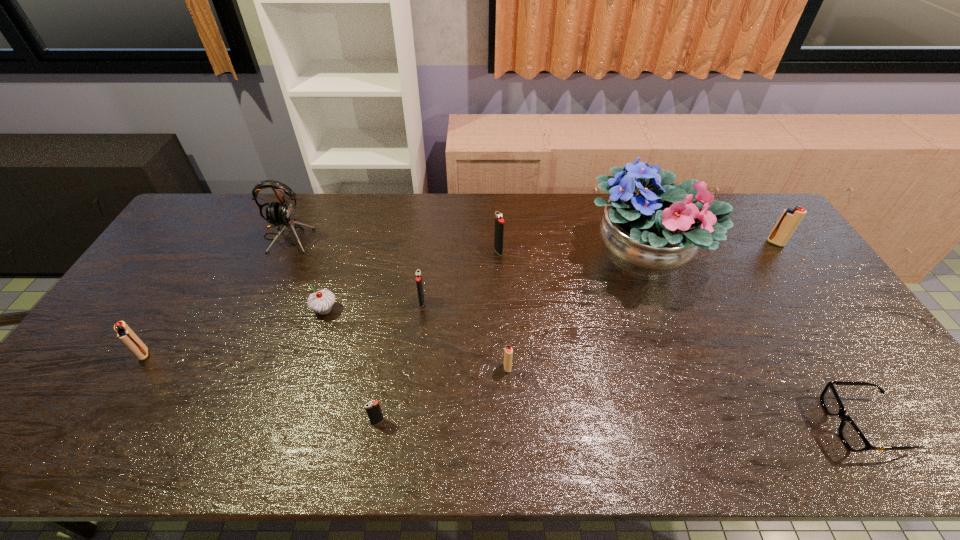
Locate an element on the screen. This screenshot has height=540, width=960. free space that is in between the nearest red igniter and the rightmost igniter is located at coordinates (641, 305).

The height and width of the screenshot is (540, 960). I want to click on vacant region between the rightmost red igniter and the third igniter from left to right, so click(599, 272).

The width and height of the screenshot is (960, 540). Find the location of `empty space between the seventh object from right to left and the rightmost black igniter`. empty space between the seventh object from right to left and the rightmost black igniter is located at coordinates (438, 336).

Find the location of a particular element. The image size is (960, 540). vacant space that's between the rightmost igniter and the eighth object from right to left is located at coordinates (550, 276).

Identify the location of vacant region between the tallest object and the black sunglasses. (754, 341).

At what (x,y) coordinates should I click in order to perform the action: click on object that stands as the eighth closest to the fourth nearest object. Please return your answer as a coordinate pair (x, y). The image size is (960, 540). Looking at the image, I should click on (850, 434).

Image resolution: width=960 pixels, height=540 pixels. I want to click on object that is the fourth closest one to the rightmost black igniter, so click(321, 301).

This screenshot has width=960, height=540. I want to click on igniter object that ranks as the fourth closest to the second red igniter from left to right, so click(x=124, y=333).

Point out which igniter is positioned as the nearest to the second igniter from left to right. Please provide its 2D coordinates. Your answer should be formatted as a tuple, i.e. [(x, y)], where the tuple contains the x and y coordinates of a point satisfying the conditions above.

[(508, 351)]

At what (x,y) coordinates should I click in order to perform the action: click on red igniter identified as the second closest to the rightmost red igniter. Please return your answer as a coordinate pair (x, y). This screenshot has height=540, width=960. Looking at the image, I should click on click(x=124, y=333).